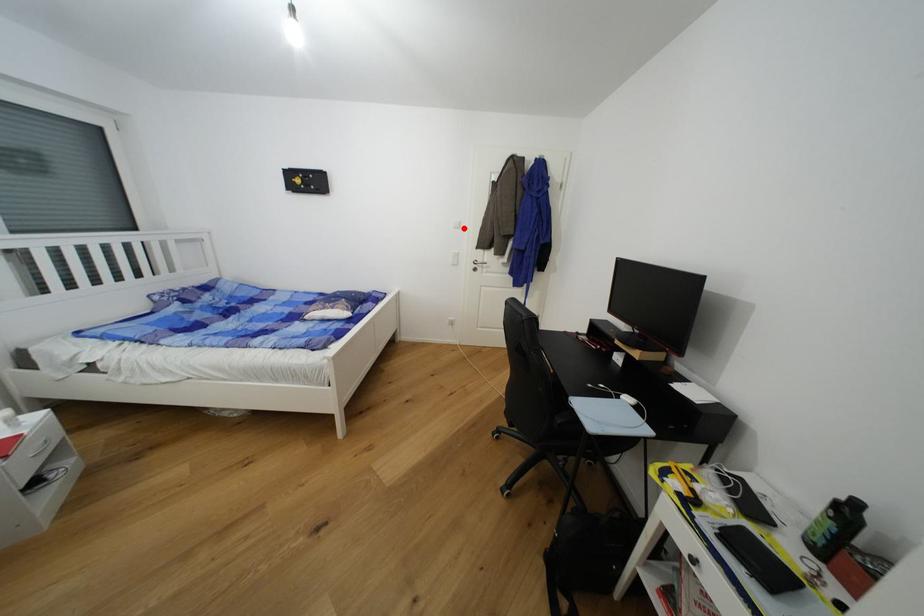
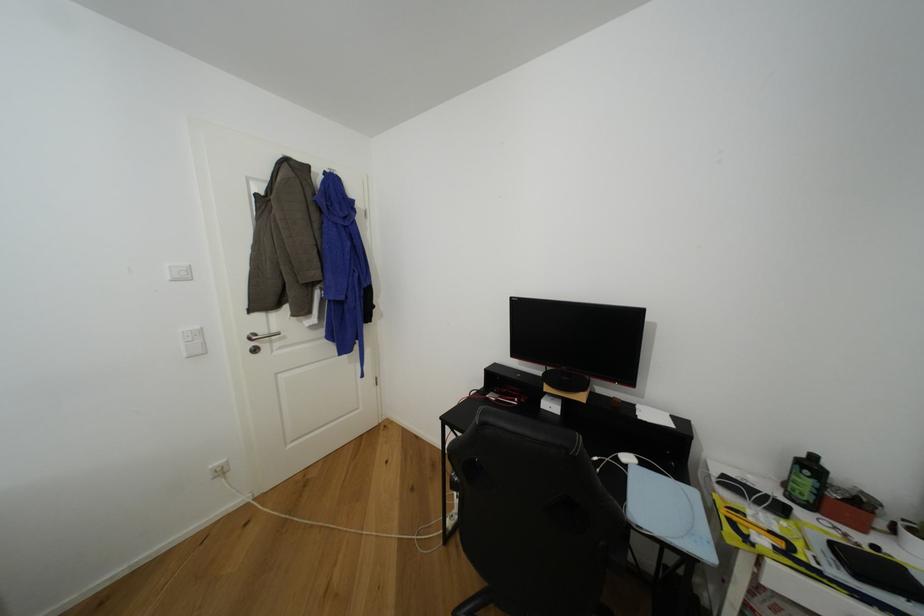
Question: I am providing you with two images of the same scene from different viewpoints. Given a red point in image1, look at the same physical point in image2. Is it:

Choices:
 (A) Closer to the viewpoint
 (B) Farther from the viewpoint

Answer: (B)